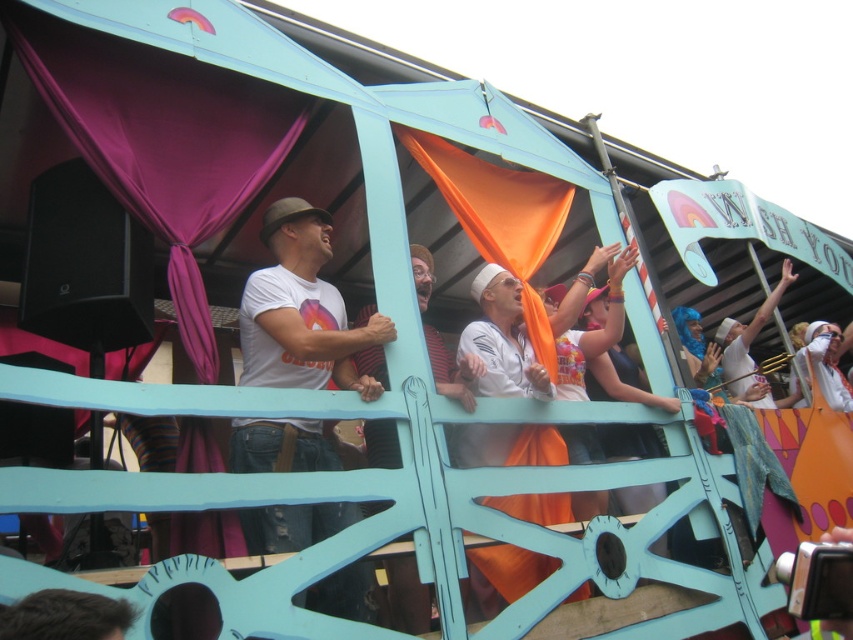
Does white t-shirt at center have a lesser height compared to white matte shirt at center?

Indeed, white t-shirt at center has a lesser height compared to white matte shirt at center.

Is white t-shirt at center taller than white matte shirt at center?

Incorrect, white t-shirt at center's height is not larger of white matte shirt at center's.

Which is in front, point (310, 282) or point (486, 424)?

Positioned in front is point (486, 424).

Where is `white t-shirt at center`? The image size is (853, 640). white t-shirt at center is located at coordinates (300, 310).

Does white t-shirt at center have a lesser width compared to matte white shirt at center?

Incorrect, white t-shirt at center's width is not less than matte white shirt at center's.

Does white t-shirt at center have a greater width compared to matte white shirt at center?

Yes.

You are a GUI agent. You are given a task and a screenshot of the screen. Output one action in this format:
    pyautogui.click(x=<x>, y=<y>)
    Task: Click on the white t-shirt at center
    
    Given the screenshot: What is the action you would take?
    pyautogui.click(x=300, y=310)

Find the location of a particular element. The width and height of the screenshot is (853, 640). white t-shirt at center is located at coordinates (300, 310).

Can you confirm if white matte shirt at center is positioned above matte white shirt at center?

No, white matte shirt at center is not above matte white shirt at center.

Does white matte shirt at center appear on the right side of matte white shirt at center?

Correct, you'll find white matte shirt at center to the right of matte white shirt at center.

Describe the element at coordinates (502, 339) in the screenshot. I see `white matte shirt at center` at that location.

Find the location of a particular element. The height and width of the screenshot is (640, 853). white matte shirt at center is located at coordinates (502, 339).